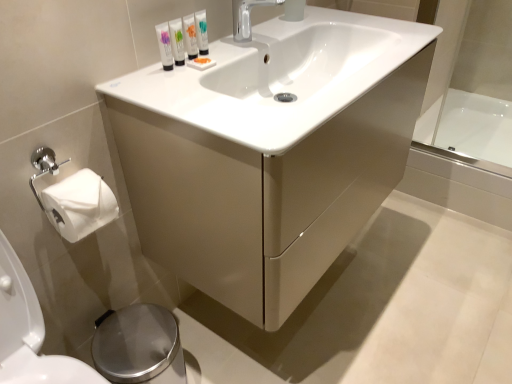
Image resolution: width=512 pixels, height=384 pixels. What do you see at coordinates (201, 32) in the screenshot?
I see `white glossy tube at upper center, which is the 4th mouthwash in left-to-right order` at bounding box center [201, 32].

I want to click on polished stainless steel bidet at lower left, so click(139, 346).

The height and width of the screenshot is (384, 512). Describe the element at coordinates (279, 77) in the screenshot. I see `white glossy sink at center` at that location.

Describe the element at coordinates (270, 152) in the screenshot. I see `matte white cabinet at center` at that location.

This screenshot has width=512, height=384. Identify the location of matte white tube at upper center, marked as the 3th mouthwash in a left-to-right arrangement. (190, 36).

Describe the element at coordinates (247, 17) in the screenshot. I see `chrome metallic faucet at center` at that location.

Where is `white glossy tube at upper center, which is the first mouthwash in right-to-left order`? The image size is (512, 384). white glossy tube at upper center, which is the first mouthwash in right-to-left order is located at coordinates (201, 32).

Is the depth of matte white cabinet at center less than that of white glossy tube at upper center, which is the 4th mouthwash in left-to-right order?

Yes, matte white cabinet at center is closer to the camera.

Is white glossy tube at upper center, which is the first mouthwash in right-to-left order, located within matte white cabinet at center?

Definitely not — white glossy tube at upper center, which is the first mouthwash in right-to-left order, is not inside matte white cabinet at center.

Consider the image. How many degrees apart are the facing directions of matte white cabinet at center and white glossy tube at upper center, which is the 4th mouthwash in left-to-right order?

0.801 degrees.

Which object is positioned more to the left, matte white cabinet at center or white glossy tube at upper center, which is the first mouthwash in right-to-left order?

white glossy tube at upper center, which is the first mouthwash in right-to-left order.

From a real-world perspective, between white glossy tube at upper center, placed as the fourth mouthwash when sorted from right to left, and polished stainless steel bidet at lower left, who is vertically higher?

white glossy tube at upper center, placed as the fourth mouthwash when sorted from right to left, from a real-world perspective.

Could you tell me if white glossy tube at upper center, arranged as the 1th mouthwash when viewed from the left, is turned towards polished stainless steel bidet at lower left?

No, white glossy tube at upper center, arranged as the 1th mouthwash when viewed from the left, is not aimed at polished stainless steel bidet at lower left.

This screenshot has width=512, height=384. In order to click on sink that is on the right side of matte white cabinet at center in this screenshot , I will do `click(279, 77)`.

Is white glossy sink at center located outside matte white cabinet at center?

Actually, white glossy sink at center is within matte white cabinet at center.

Considering the positions of points (315, 47) and (153, 154), is point (315, 47) closer to camera compared to point (153, 154)?

No, (315, 47) is behind (153, 154).

From the image's perspective, which object appears higher, matte white tube at upper center, marked as the 3th mouthwash in a left-to-right arrangement, or white glossy tube at upper center, placed as the fourth mouthwash when sorted from right to left?

From the image's view, matte white tube at upper center, marked as the 3th mouthwash in a left-to-right arrangement, is above.

Is matte white tube at upper center, the second mouthwash when ordered from right to left, positioned in front of white glossy tube at upper center, arranged as the 1th mouthwash when viewed from the left?

No, the depth of matte white tube at upper center, the second mouthwash when ordered from right to left, is greater than that of white glossy tube at upper center, arranged as the 1th mouthwash when viewed from the left.

From the picture: Can you tell me how much matte white tube at upper center, the second mouthwash when ordered from right to left, and white glossy tube at upper center, arranged as the 1th mouthwash when viewed from the left, differ in facing direction?

The angle between the facing direction of matte white tube at upper center, the second mouthwash when ordered from right to left, and the facing direction of white glossy tube at upper center, arranged as the 1th mouthwash when viewed from the left, is 3.09 degrees.

The height and width of the screenshot is (384, 512). What are the coordinates of `the 4th mouthwash below when counting from the chrome metallic faucet at center (from the image's perspective)` in the screenshot? It's located at (165, 45).

Can you tell me how much white glossy tube at upper center, arranged as the 1th mouthwash when viewed from the left, and chrome metallic faucet at center differ in facing direction?

There is a 5.28-degree angle between the facing directions of white glossy tube at upper center, arranged as the 1th mouthwash when viewed from the left, and chrome metallic faucet at center.

Which is behind, point (166, 67) or point (237, 39)?

The point (237, 39) is farther from the camera.

Considering the positions of objects chrome metallic faucet at center and white glossy sink at center in the image provided, who is more to the right, chrome metallic faucet at center or white glossy sink at center?

white glossy sink at center.

Is chrome metallic faucet at center inside the boundaries of white glossy sink at center, or outside?

The correct answer is: outside.

From a real-world perspective, is chrome metallic faucet at center below white glossy sink at center?

No, from a real-world perspective, chrome metallic faucet at center is not beneath white glossy sink at center.

From the image's perspective, is chrome metallic faucet at center under white glossy sink at center?

No.

From a real-world perspective, is white glossy tube at upper center, which is the first mouthwash in right-to-left order, physically located above or below translucent plastic tubes at upper center, the second mouthwash from the left?

In terms of real-world spatial position, white glossy tube at upper center, which is the first mouthwash in right-to-left order, is above translucent plastic tubes at upper center, the second mouthwash from the left.

Could you tell me if white glossy tube at upper center, which is the first mouthwash in right-to-left order, is facing translucent plastic tubes at upper center, positioned as the 3th mouthwash in right-to-left order?

No, white glossy tube at upper center, which is the first mouthwash in right-to-left order, is not facing towards translucent plastic tubes at upper center, positioned as the 3th mouthwash in right-to-left order.

Can you confirm if white glossy tube at upper center, which is the first mouthwash in right-to-left order, is wider than translucent plastic tubes at upper center, the second mouthwash from the left?

No, white glossy tube at upper center, which is the first mouthwash in right-to-left order, is not wider than translucent plastic tubes at upper center, the second mouthwash from the left.

You are a GUI agent. You are given a task and a screenshot of the screen. Output one action in this format:
    pyautogui.click(x=<x>, y=<y>)
    Task: Click on the bathroom cabinet below the white glossy tube at upper center, which is the 4th mouthwash in left-to-right order (from a real-world perspective)
    This screenshot has height=384, width=512.
    Given the screenshot: What is the action you would take?
    pyautogui.click(x=270, y=152)

This screenshot has width=512, height=384. Find the location of `bidet below the white glossy tube at upper center, arranged as the 1th mouthwash when viewed from the left (from the image's perspective)`. bidet below the white glossy tube at upper center, arranged as the 1th mouthwash when viewed from the left (from the image's perspective) is located at coordinates (139, 346).

From the image, which object appears to be farther from white glossy sink at center, white glossy tube at upper center, arranged as the 1th mouthwash when viewed from the left, or matte white cabinet at center?

Based on the image, white glossy tube at upper center, arranged as the 1th mouthwash when viewed from the left, appears to be further to white glossy sink at center.

Which object lies nearer to the anchor point matte white cabinet at center, white glossy sink at center or translucent plastic tubes at upper center, positioned as the 3th mouthwash in right-to-left order?

white glossy sink at center.

When comparing their distances from translucent plastic tubes at upper center, the second mouthwash from the left, does white glossy tube at upper center, which is the 4th mouthwash in left-to-right order, or chrome metallic faucet at center seem further?

chrome metallic faucet at center is positioned further to the anchor translucent plastic tubes at upper center, the second mouthwash from the left.

Looking at the image, which one is located further to white glossy tube at upper center, which is the first mouthwash in right-to-left order, translucent plastic tubes at upper center, the second mouthwash from the left, or chrome metallic faucet at center?

chrome metallic faucet at center is positioned further to the anchor white glossy tube at upper center, which is the first mouthwash in right-to-left order.

Estimate the real-world distances between objects in this image. Which object is closer to white glossy sink at center, white glossy tube at upper center, placed as the fourth mouthwash when sorted from right to left, or translucent plastic tubes at upper center, the second mouthwash from the left?

translucent plastic tubes at upper center, the second mouthwash from the left, lies closer to white glossy sink at center than the other object.

Based on their spatial positions, is white glossy tube at upper center, which is the first mouthwash in right-to-left order, or white glossy tube at upper center, arranged as the 1th mouthwash when viewed from the left, closer to chrome metallic faucet at center?

Based on the image, white glossy tube at upper center, which is the first mouthwash in right-to-left order, appears to be nearer to chrome metallic faucet at center.

Which object lies further to the anchor point matte white tube at upper center, the second mouthwash when ordered from right to left, matte white cabinet at center or white glossy bathtub at right?

Based on the image, white glossy bathtub at right appears to be further to matte white tube at upper center, the second mouthwash when ordered from right to left.

Estimate the real-world distances between objects in this image. Which object is further from matte white cabinet at center, white glossy bathtub at right or matte white tube at upper center, the second mouthwash when ordered from right to left?

Among the two, white glossy bathtub at right is located further to matte white cabinet at center.

At what (x,y) coordinates should I click in order to perform the action: click on bathroom cabinet located between translucent plastic tubes at upper center, the second mouthwash from the left, and white glossy bathtub at right in the left-right direction. Please return your answer as a coordinate pair (x, y). The width and height of the screenshot is (512, 384). Looking at the image, I should click on (270, 152).

Find the location of `bathroom cabinet situated between white glossy tube at upper center, which is the 4th mouthwash in left-to-right order, and white glossy bathtub at right from left to right`. bathroom cabinet situated between white glossy tube at upper center, which is the 4th mouthwash in left-to-right order, and white glossy bathtub at right from left to right is located at coordinates (x=270, y=152).

This screenshot has width=512, height=384. I want to click on sink between white glossy tube at upper center, which is the 4th mouthwash in left-to-right order, and white glossy bathtub at right, in the horizontal direction, so click(x=279, y=77).

Locate an element on the screen. The image size is (512, 384). bathroom cabinet positioned between white glossy sink at center and white glossy tube at upper center, which is the 4th mouthwash in left-to-right order, from near to far is located at coordinates (270, 152).